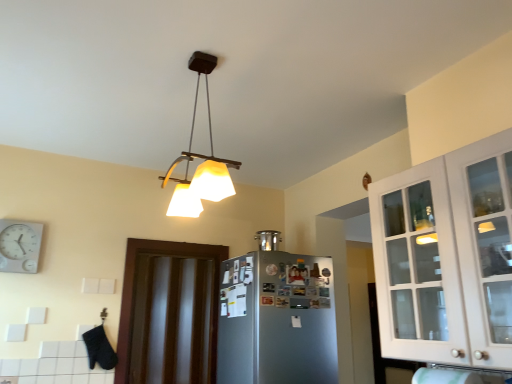
Question: Is satin silver refrigerator at center at the left side of satin silver pot at upper center?

Choices:
 (A) no
 (B) yes

Answer: (A)

Question: From the image's perspective, would you say satin silver refrigerator at center is shown under satin silver pot at upper center?

Choices:
 (A) yes
 (B) no

Answer: (A)

Question: Would you say satin silver pot at upper center is part of satin silver refrigerator at center's contents?

Choices:
 (A) no
 (B) yes

Answer: (A)

Question: Is satin silver refrigerator at center wider than satin silver pot at upper center?

Choices:
 (A) yes
 (B) no

Answer: (A)

Question: Is satin silver refrigerator at center positioned with its back to satin silver pot at upper center?

Choices:
 (A) yes
 (B) no

Answer: (B)

Question: From the image's perspective, does satin silver refrigerator at center appear higher than satin silver pot at upper center?

Choices:
 (A) yes
 (B) no

Answer: (B)

Question: From a real-world perspective, is white plastic clock at upper left physically above satin silver pot at upper center?

Choices:
 (A) yes
 (B) no

Answer: (B)

Question: Does white plastic clock at upper left turn towards satin silver pot at upper center?

Choices:
 (A) yes
 (B) no

Answer: (B)

Question: Is white plastic clock at upper left bigger than satin silver pot at upper center?

Choices:
 (A) yes
 (B) no

Answer: (A)

Question: Does white plastic clock at upper left appear on the right side of satin silver pot at upper center?

Choices:
 (A) yes
 (B) no

Answer: (B)

Question: Is white plastic clock at upper left outside satin silver pot at upper center?

Choices:
 (A) yes
 (B) no

Answer: (A)

Question: Does white plastic clock at upper left have a greater height compared to satin silver pot at upper center?

Choices:
 (A) yes
 (B) no

Answer: (A)

Question: Does matte white lampshade at upper center turn towards dark wood door at center?

Choices:
 (A) no
 (B) yes

Answer: (A)